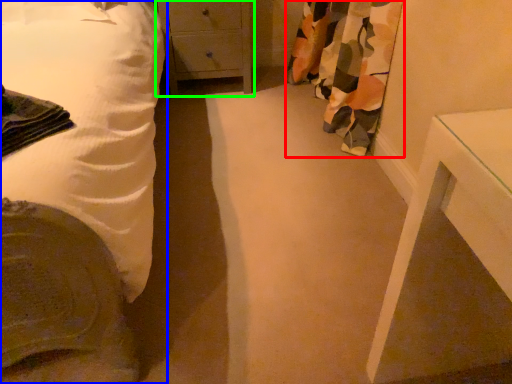
Question: Which object is the closest to the curtain (highlighted by a red box)? Choose among these: bed (highlighted by a blue box) or chest of drawers (highlighted by a green box).

Choices:
 (A) bed
 (B) chest of drawers

Answer: (B)